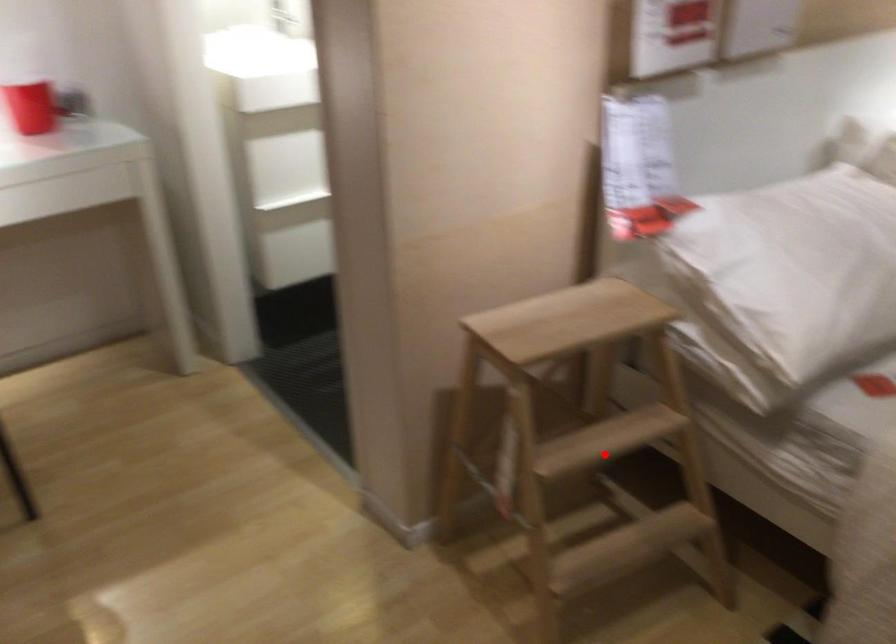
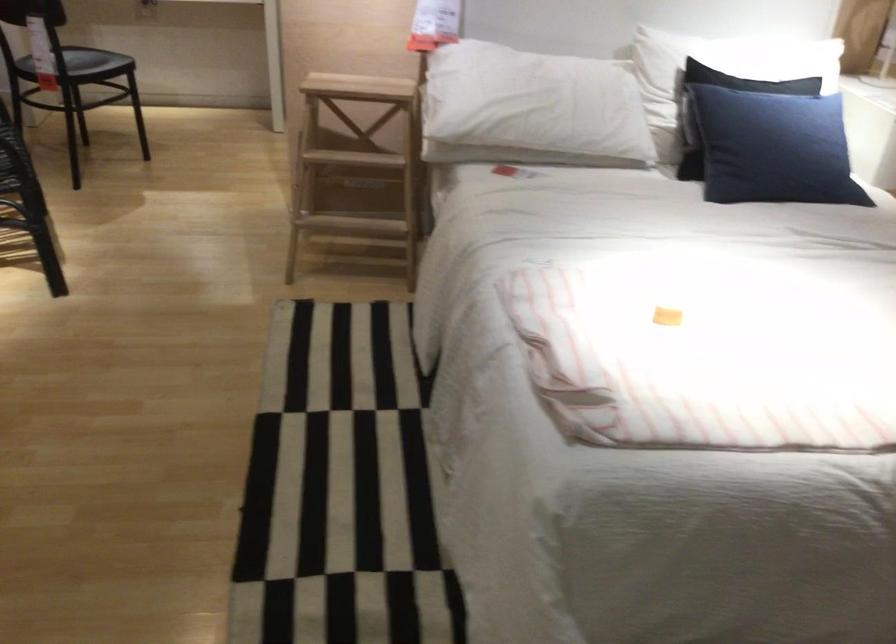
Question: I am providing you with two images of the same scene from different viewpoints. In image1, a red point is highlighted. Considering the same 3D point in image2, which of the following is correct?

Choices:
 (A) It is closer
 (B) It is farther

Answer: (B)